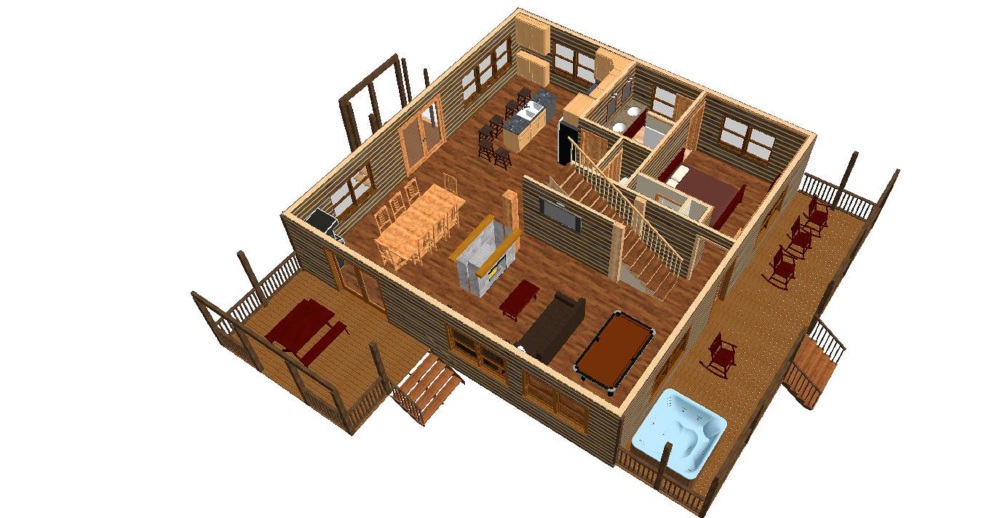
In order to click on living room fireplace in this screenshot , I will do `click(486, 267)`.